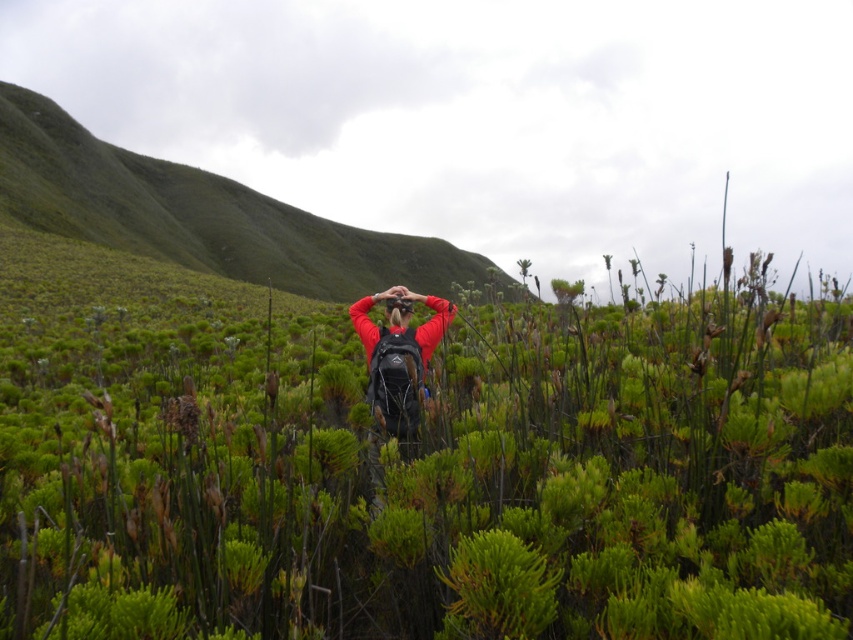
Question: Is green grassy hillside at upper left wider than matte black backpack at center?

Choices:
 (A) no
 (B) yes

Answer: (B)

Question: Which object appears closest to the camera in this image?

Choices:
 (A) green grassy hillside at upper left
 (B) matte black backpack at center

Answer: (B)

Question: Does green grassy hillside at upper left appear on the left side of matte black backpack at center?

Choices:
 (A) no
 (B) yes

Answer: (B)

Question: Does green grassy hillside at upper left appear under matte black backpack at center?

Choices:
 (A) no
 (B) yes

Answer: (A)

Question: Which point is closer to the camera taking this photo?

Choices:
 (A) (386, 401)
 (B) (161, 195)

Answer: (A)